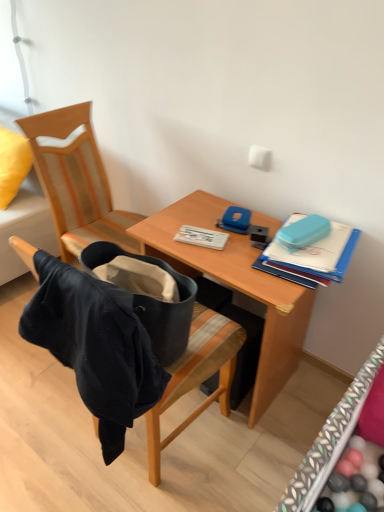
Question: From a real-world perspective, is teal plastic case at upper right physically located above or below velvet black bag at center, the 2th chair from the back?

Choices:
 (A) above
 (B) below

Answer: (A)

Question: From their relative heights in the image, would you say teal plastic case at upper right is taller or shorter than velvet black bag at center, the first chair viewed from the front?

Choices:
 (A) short
 (B) tall

Answer: (A)

Question: Estimate the real-world distances between objects in this image. Which object is farther from the velvet black bag at center, the first chair viewed from the front?

Choices:
 (A) wooden desk at center
 (B) teal plastic case at upper right
 (C) velvet black jacket at left, placed as the 1th chair when sorted from back to front
 (D) white plastic notebook at center
 (E) velvet yellow pillow at upper left

Answer: (E)

Question: Which of these objects is positioned farthest from the velvet yellow pillow at upper left?

Choices:
 (A) white plastic notebook at center
 (B) velvet black bag at center, the first chair viewed from the front
 (C) wooden desk at center
 (D) teal plastic case at upper right
 (E) velvet black jacket at left, placed as the 1th chair when sorted from back to front

Answer: (D)